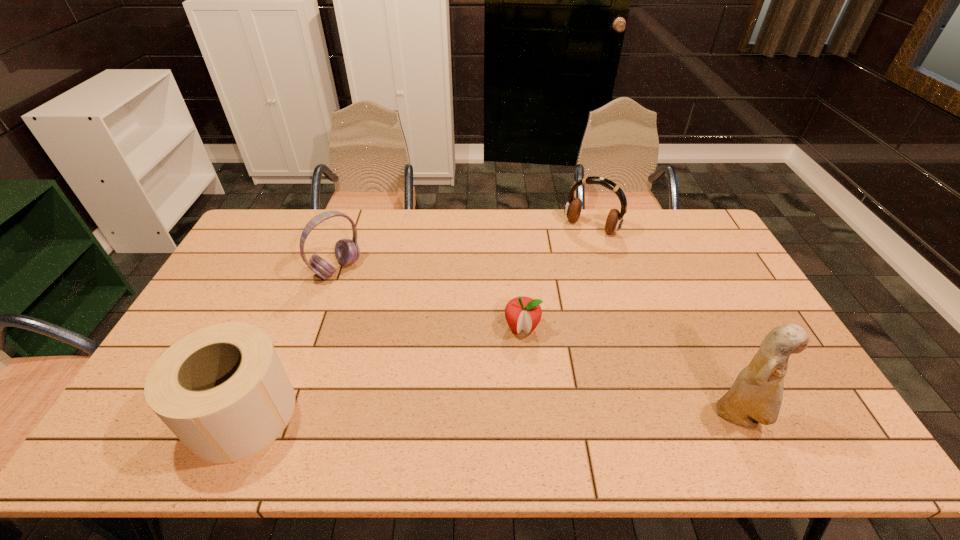
Identify the location of free space located 0.390m on the headband and ear cups of the nearer headset. The width and height of the screenshot is (960, 540). (435, 342).

Find the location of a particular element. The image size is (960, 540). vacant region located on the headband and ear cups of the nearer headset is located at coordinates (382, 303).

This screenshot has height=540, width=960. I want to click on vacant space located on the headband and ear cups of the nearer headset, so click(374, 297).

The height and width of the screenshot is (540, 960). What are the coordinates of `free spot located on the side where a bite is taken out of the apple` in the screenshot? It's located at tap(519, 364).

Locate an element on the screen. The height and width of the screenshot is (540, 960). free region located 0.060m on the side where a bite is taken out of the apple is located at coordinates (519, 358).

Find the location of `vacant space located on the side where a bite is taken out of the apple`. vacant space located on the side where a bite is taken out of the apple is located at coordinates (518, 373).

Locate an element on the screen. vacant space situated on the ear cup of the second object from right to left is located at coordinates (568, 257).

Locate an element on the screen. This screenshot has height=540, width=960. free region located on the ear cup of the second object from right to left is located at coordinates (573, 249).

Locate an element on the screen. The height and width of the screenshot is (540, 960). free location located 0.210m on the ear cup of the second object from right to left is located at coordinates (558, 272).

Identify the location of object located at the far edge. (573, 208).